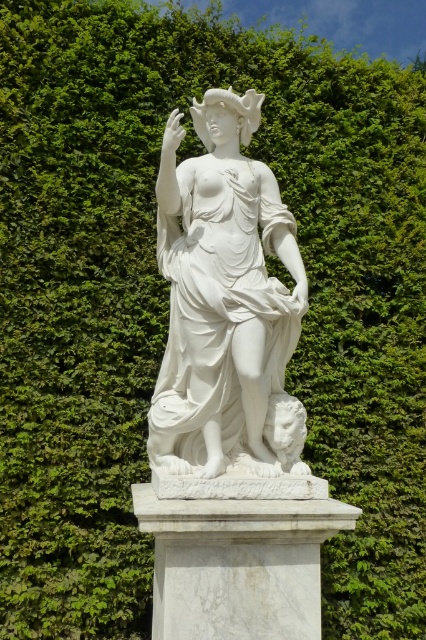
What do you see at coordinates (221, 296) in the screenshot?
I see `white marble statue at center` at bounding box center [221, 296].

Is white marble statue at center wider than white marble pedestal at center?

No, white marble statue at center is not wider than white marble pedestal at center.

Does point (244, 285) lie in front of point (262, 570)?

No, (244, 285) is behind (262, 570).

I want to click on white marble statue at center, so click(221, 296).